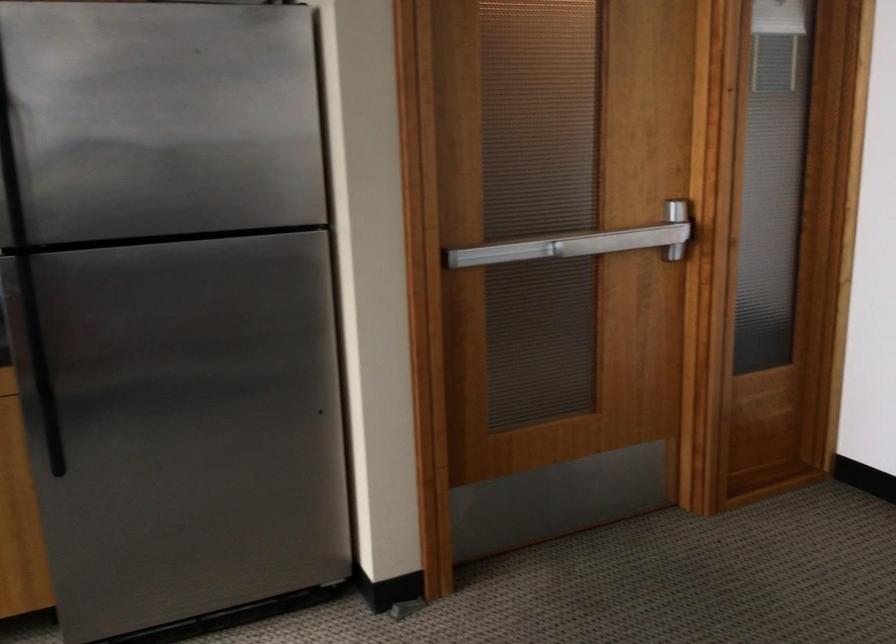
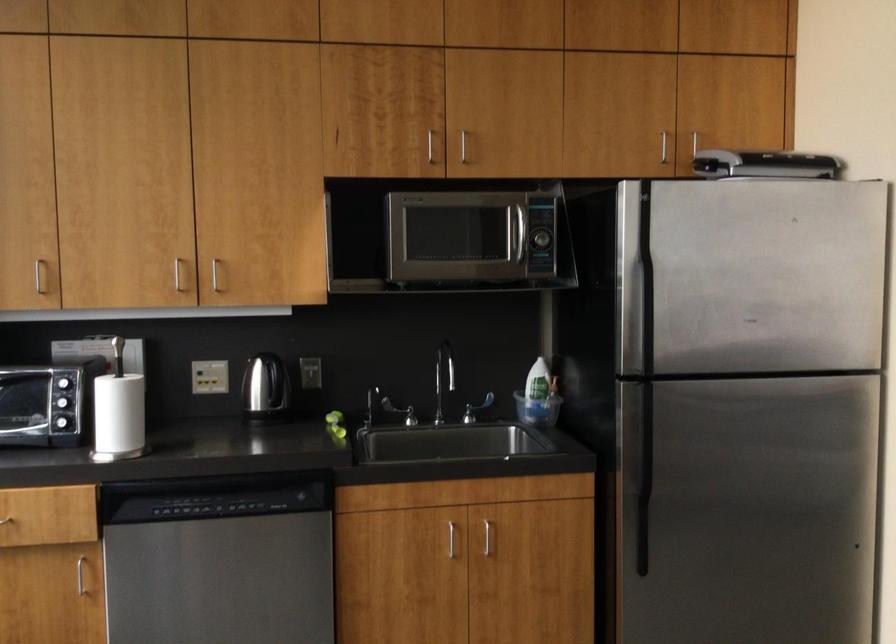
What movement of the cameraman would produce the second image?

The cameraman walked toward left, backward.